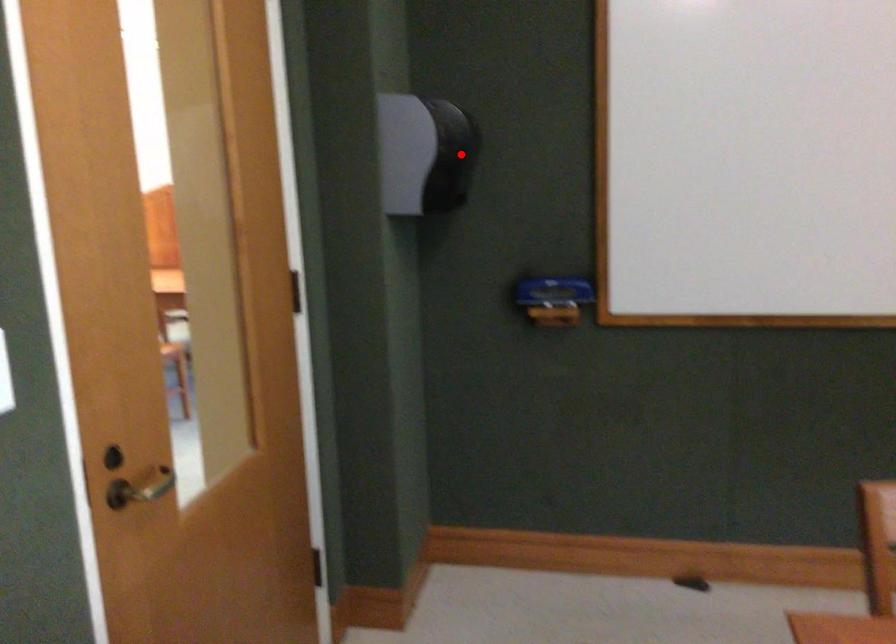
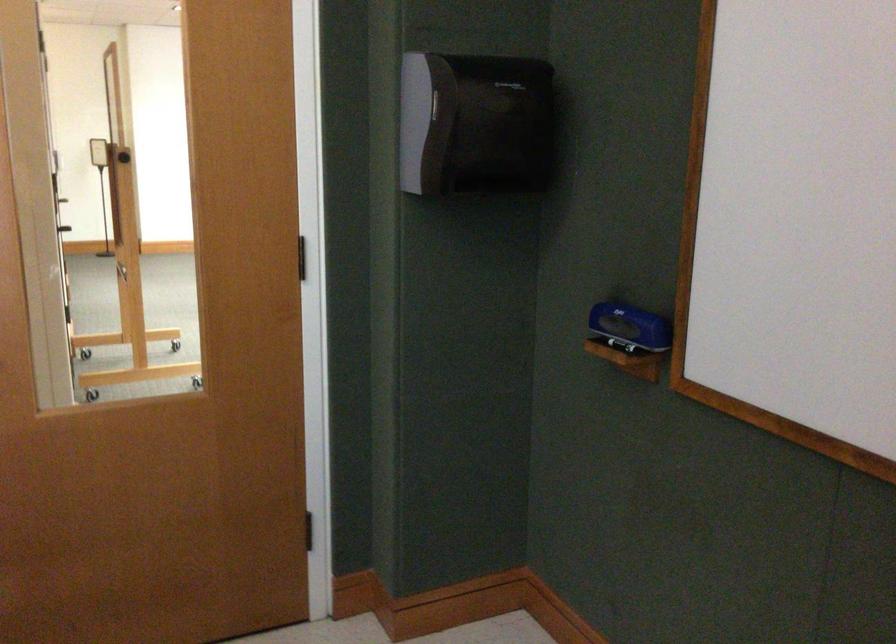
Find the pixel in the second image that matches the highlighted location in the first image.

(474, 122)